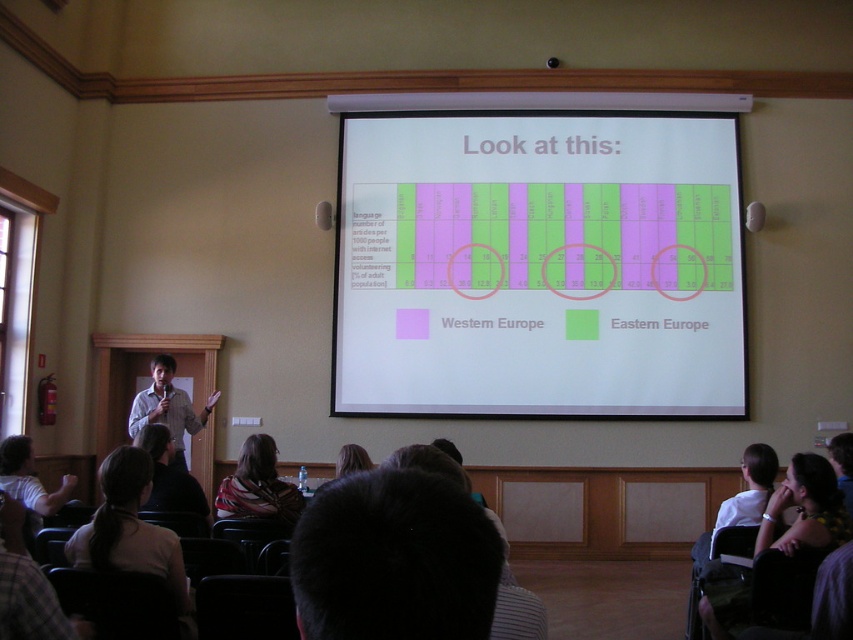
You are sitting in the lecture hall and want to take a photo of the white matte projection screen at center for your notes. The screen is at coordinates 0.416 on the horizontal axis and 0.632 on the vertical axis. If your camera has a zoom lens that can focus on objects within a 0.5 unit radius from the center point, will the screen be fully in focus?

The white matte projection screen at center is located at point (538, 266). Since the camera can focus within a 0.5 unit radius from the center point, the screen will be fully in focus as its coordinates are within the focus range.